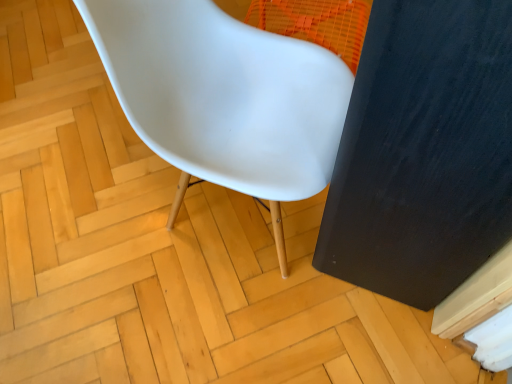
Where is `black matte screen door at right`? This screenshot has width=512, height=384. black matte screen door at right is located at coordinates (423, 151).

Describe the element at coordinates (423, 151) in the screenshot. I see `black matte screen door at right` at that location.

In order to face black matte screen door at right, should I rotate leftwards or rightwards?

To align with it, rotate right about 21.338°.

Image resolution: width=512 pixels, height=384 pixels. Identify the location of white plastic chair at center. (224, 98).

Measure the distance between point (262, 106) and camera.

A distance of 3.30 feet exists between point (262, 106) and camera.

What is the approximate width of white plastic chair at center?

21.38 inches.

What do you see at coordinates (224, 98) in the screenshot? I see `white plastic chair at center` at bounding box center [224, 98].

Locate an element on the screen. black matte screen door at right is located at coordinates (423, 151).

Does white plastic chair at center appear on the right side of black matte screen door at right?

No.

Considering their positions, is white plastic chair at center located in front of or behind black matte screen door at right?

white plastic chair at center is behind black matte screen door at right.

Considering the points (143, 106) and (400, 13), which point is in front, point (143, 106) or point (400, 13)?

The point (400, 13) is in front.

Based on the photo, from the image's perspective, which one is positioned higher, white plastic chair at center or black matte screen door at right?

white plastic chair at center.

From a real-world perspective, is white plastic chair at center under black matte screen door at right?

Yes, from a real-world perspective, white plastic chair at center is under black matte screen door at right.

Considering the sizes of objects white plastic chair at center and black matte screen door at right in the image provided, who is thinner, white plastic chair at center or black matte screen door at right?

black matte screen door at right.

Is white plastic chair at center taller or shorter than black matte screen door at right?

In the image, white plastic chair at center appears to be shorter than black matte screen door at right.

Considering the sizes of white plastic chair at center and black matte screen door at right in the image, is white plastic chair at center bigger or smaller than black matte screen door at right?

In the image, white plastic chair at center appears to be larger than black matte screen door at right.

Is white plastic chair at center completely or partially outside of black matte screen door at right?

white plastic chair at center is positioned outside black matte screen door at right.

Is white plastic chair at center not close to black matte screen door at right?

No, white plastic chair at center is not far from black matte screen door at right.

Is white plastic chair at center looking in the opposite direction of black matte screen door at right?

No, white plastic chair at center's orientation is not away from black matte screen door at right.

The image size is (512, 384). I want to click on screen door above the white plastic chair at center (from a real-world perspective), so click(x=423, y=151).

Does black matte screen door at right appear on the right side of white plastic chair at center?

Indeed, black matte screen door at right is positioned on the right side of white plastic chair at center.

Which is in front, black matte screen door at right or white plastic chair at center?

black matte screen door at right is more forward.

Considering the positions of points (399, 256) and (270, 38), is point (399, 256) closer to camera compared to point (270, 38)?

Yes, it is in front of point (270, 38).

From the image's perspective, is black matte screen door at right on white plastic chair at center?

Incorrect, from the image's perspective, black matte screen door at right is lower than white plastic chair at center.

From a real-world perspective, who is located lower, black matte screen door at right or white plastic chair at center?

From a 3D spatial view, white plastic chair at center is below.

Considering the sizes of objects black matte screen door at right and white plastic chair at center in the image provided, who is wider, black matte screen door at right or white plastic chair at center?

With larger width is white plastic chair at center.

Which of these two, black matte screen door at right or white plastic chair at center, stands shorter?

white plastic chair at center is shorter.

Who is smaller, black matte screen door at right or white plastic chair at center?

Smaller between the two is black matte screen door at right.

Choose the correct answer: Is black matte screen door at right inside white plastic chair at center or outside it?

black matte screen door at right is spatially situated outside white plastic chair at center.

Are black matte screen door at right and white plastic chair at center located far from each other?

No, black matte screen door at right is not far away from white plastic chair at center.

Is black matte screen door at right facing towards white plastic chair at center?

Yes, black matte screen door at right is facing white plastic chair at center.

How many degrees apart are the facing directions of black matte screen door at right and white plastic chair at center?

The facing directions of black matte screen door at right and white plastic chair at center are 179 degrees apart.

How much distance is there between black matte screen door at right and white plastic chair at center?

12.49 inches.

What are the coordinates of `screen door below the white plastic chair at center (from the image's perspective)` in the screenshot? It's located at (423, 151).

This screenshot has width=512, height=384. I want to click on chair on the left of the black matte screen door at right, so click(x=224, y=98).

This screenshot has height=384, width=512. In the image, there is a black matte screen door at right. Find the location of `chair above it (from the image's perspective)`. chair above it (from the image's perspective) is located at coordinates (224, 98).